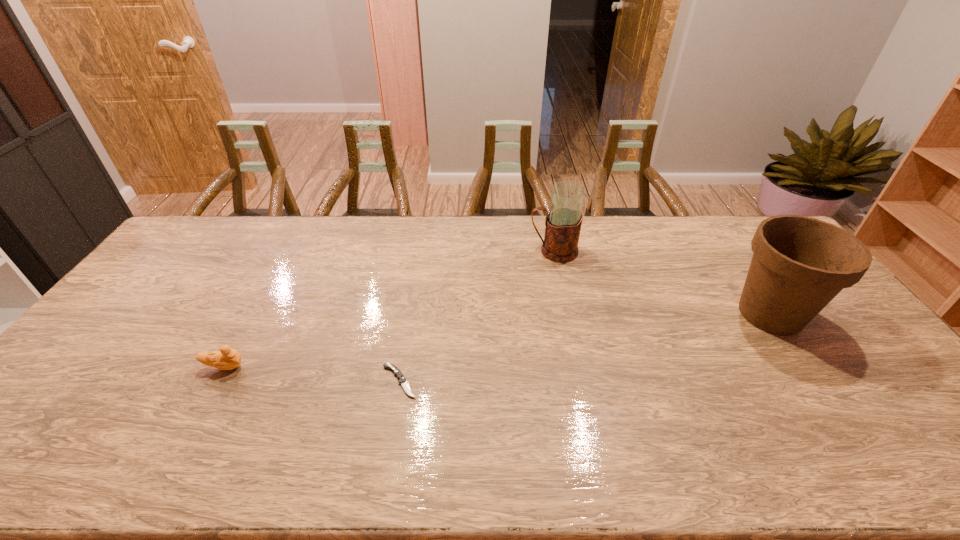
What are the coordinates of `free space between the farthest object and the shortest object` in the screenshot? It's located at (476, 316).

You are a GUI agent. You are given a task and a screenshot of the screen. Output one action in this format:
    pyautogui.click(x=<x>, y=<y>)
    Task: Click on the blank region between the leftmost object and the second object from right to left
    Image resolution: width=960 pixels, height=540 pixels.
    Given the screenshot: What is the action you would take?
    pyautogui.click(x=389, y=309)

The image size is (960, 540). What are the coordinates of `the closest object relative to the pitcher` in the screenshot? It's located at (799, 264).

Locate which object ranks in proximity to the leftmost object. Please provide its 2D coordinates. Your answer should be formatted as a tuple, i.e. [(x, y)], where the tuple contains the x and y coordinates of a point satisfying the conditions above.

[(402, 380)]

At what (x,y) coordinates should I click in order to perform the action: click on vacant area in the image that satisfies the following two spatial constraints: 1. on the face of the shortest object; 2. on the right side of the second shortest object. Please return your answer as a coordinate pair (x, y). The image size is (960, 540). Looking at the image, I should click on pos(217,381).

The height and width of the screenshot is (540, 960). In order to click on vacant space that satisfies the following two spatial constraints: 1. with the handle on the side of the second object from right to left; 2. on the back side of the flowerpot in this screenshot , I will do `click(566, 314)`.

Identify the location of vacant area in the image that satisfies the following two spatial constraints: 1. on the back side of the third nearest object; 2. with the handle on the side of the farthest object. (727, 251).

Identify the location of blank space that satisfies the following two spatial constraints: 1. with the handle on the side of the farthest object; 2. on the left side of the flowerpot. (566, 314).

You are a GUI agent. You are given a task and a screenshot of the screen. Output one action in this format:
    pyautogui.click(x=<x>, y=<y>)
    Task: Click on the vacant space that satisfies the following two spatial constraints: 1. on the face of the third tallest object; 2. on the back side of the shortest object
    
    Given the screenshot: What is the action you would take?
    (217, 381)